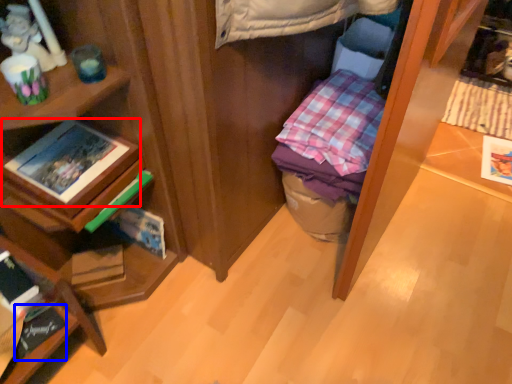
Question: Which object is closer to the camera taking this photo, book (highlighted by a red box) or book (highlighted by a blue box)?

Choices:
 (A) book
 (B) book

Answer: (A)